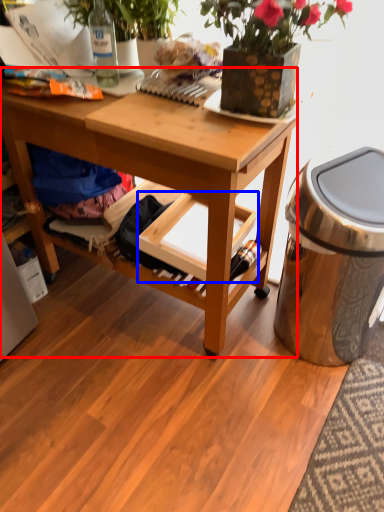
Question: Which point is further to the camera, desk (highlighted by a red box) or shelf (highlighted by a blue box)?

Choices:
 (A) desk
 (B) shelf

Answer: (B)